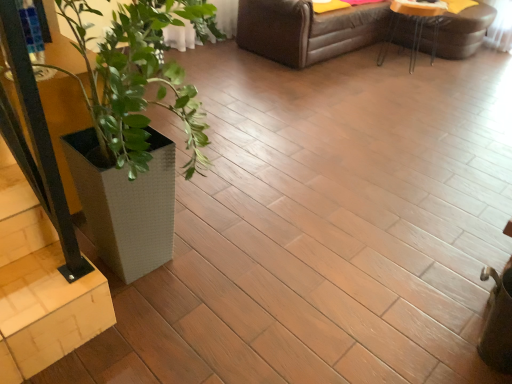
Question: Can you confirm if white textured planter at left is positioned to the right of white textured planter at lower left?

Choices:
 (A) yes
 (B) no

Answer: (A)

Question: Can you confirm if white textured planter at left is smaller than white textured planter at lower left?

Choices:
 (A) yes
 (B) no

Answer: (B)

Question: Can you confirm if white textured planter at left is taller than white textured planter at lower left?

Choices:
 (A) yes
 (B) no

Answer: (A)

Question: Is white textured planter at lower left inside white textured planter at left?

Choices:
 (A) no
 (B) yes

Answer: (B)

Question: Is white textured planter at left shorter than white textured planter at lower left?

Choices:
 (A) no
 (B) yes

Answer: (A)

Question: From a real-world perspective, relative to white textured planter at left, is white textured planter at lower left vertically above or below?

Choices:
 (A) below
 (B) above

Answer: (A)

Question: Do you think white textured planter at lower left is within white textured planter at left, or outside of it?

Choices:
 (A) inside
 (B) outside

Answer: (A)

Question: Looking at the image, does white textured planter at lower left seem bigger or smaller compared to white textured planter at left?

Choices:
 (A) small
 (B) big

Answer: (A)

Question: In terms of width, does white textured planter at lower left look wider or thinner when compared to white textured planter at left?

Choices:
 (A) thin
 (B) wide

Answer: (A)

Question: From a real-world perspective, is light wood stairwell at lower left positioned above or below white textured planter at lower left?

Choices:
 (A) below
 (B) above

Answer: (A)

Question: From the image's perspective, relative to white textured planter at lower left, is light wood stairwell at lower left above or below?

Choices:
 (A) below
 (B) above

Answer: (A)

Question: Is light wood stairwell at lower left inside or outside of white textured planter at lower left?

Choices:
 (A) inside
 (B) outside

Answer: (B)

Question: Considering the positions of point (0, 248) and point (98, 183), is point (0, 248) closer or farther from the camera than point (98, 183)?

Choices:
 (A) closer
 (B) farther

Answer: (B)

Question: Considering the positions of white textured planter at lower left and light wood stairwell at lower left in the image, is white textured planter at lower left wider or thinner than light wood stairwell at lower left?

Choices:
 (A) wide
 (B) thin

Answer: (B)

Question: Is point (101, 162) closer or farther from the camera than point (29, 223)?

Choices:
 (A) closer
 (B) farther

Answer: (B)